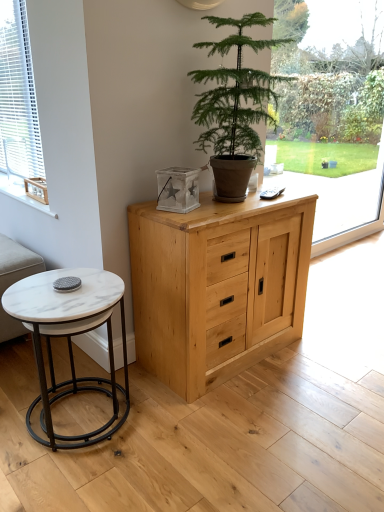
Question: Does white blinds at left appear on the right side of wooden crate at left?

Choices:
 (A) no
 (B) yes

Answer: (A)

Question: From a real-world perspective, is white blinds at left positioned under wooden crate at left based on gravity?

Choices:
 (A) no
 (B) yes

Answer: (A)

Question: Can you confirm if white blinds at left is shorter than wooden crate at left?

Choices:
 (A) no
 (B) yes

Answer: (A)

Question: From a real-world perspective, does white blinds at left stand above wooden crate at left?

Choices:
 (A) no
 (B) yes

Answer: (B)

Question: From the image's perspective, is white blinds at left over wooden crate at left?

Choices:
 (A) yes
 (B) no

Answer: (A)

Question: Considering their positions, is wooden crate at left located in front of or behind white marble coffee table at lower left?

Choices:
 (A) front
 (B) behind

Answer: (B)

Question: From a real-world perspective, is wooden crate at left physically located above or below white marble coffee table at lower left?

Choices:
 (A) below
 (B) above

Answer: (B)

Question: Which is correct: wooden crate at left is inside white marble coffee table at lower left, or outside of it?

Choices:
 (A) inside
 (B) outside

Answer: (B)

Question: From the image's perspective, relative to white marble coffee table at lower left, is wooden crate at left above or below?

Choices:
 (A) below
 (B) above

Answer: (B)

Question: From the image's perspective, relative to white marble coffee table at lower left, is beige fabric couch at lower left above or below?

Choices:
 (A) above
 (B) below

Answer: (A)

Question: From a real-world perspective, is beige fabric couch at lower left physically located above or below white marble coffee table at lower left?

Choices:
 (A) below
 (B) above

Answer: (A)

Question: Is beige fabric couch at lower left to the left or to the right of white marble coffee table at lower left in the image?

Choices:
 (A) right
 (B) left

Answer: (B)

Question: Is beige fabric couch at lower left taller or shorter than white marble coffee table at lower left?

Choices:
 (A) short
 (B) tall

Answer: (A)

Question: Relative to green leafy plant at center, is beige fabric couch at lower left in front or behind?

Choices:
 (A) front
 (B) behind

Answer: (B)

Question: Looking at their shapes, would you say beige fabric couch at lower left is wider or thinner than green leafy plant at center?

Choices:
 (A) wide
 (B) thin

Answer: (B)